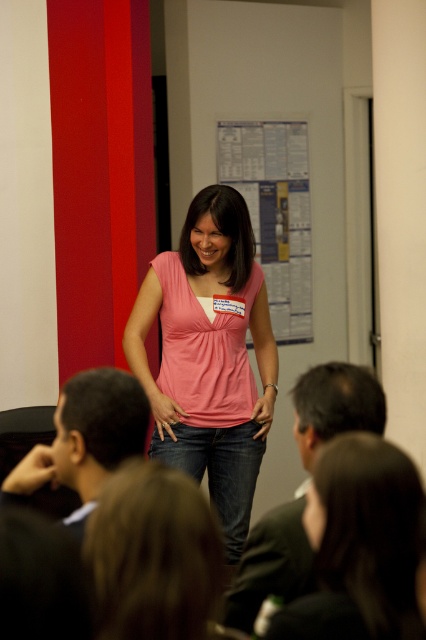
You are an event planner setting up a photo backdrop for a presentation. The backdrop needs to be taller than the presenter to ensure it covers the entire frame. The presenter is wearing a pink matte tank top at center and there is a white paperboard at center. Which object should you choose as the backdrop?

The pink matte tank top at center is taller than the white paperboard at center, so you should choose the pink matte tank top at center as the backdrop to ensure it covers the entire frame.

You are an event planner setting up a presentation. You have a pink matte tank top at center and a white paperboard at center. Which item should you adjust first if you need to ensure the presenter can be seen clearly by the audience?

The pink matte tank top at center is closer to the viewer than the white paperboard at center. To ensure the presenter can be seen clearly, you should adjust the white paperboard at center first, moving it closer or repositioning it so it doesn not block the presenter.

You are an event organizer who needs to ensure the presenter can move freely. The pink matte tank top at center and the white paperboard at center are in the same area. Which object takes up more space in that area?

The pink matte tank top at center is larger in size than the white paperboard at center, so it takes up more space in that area.